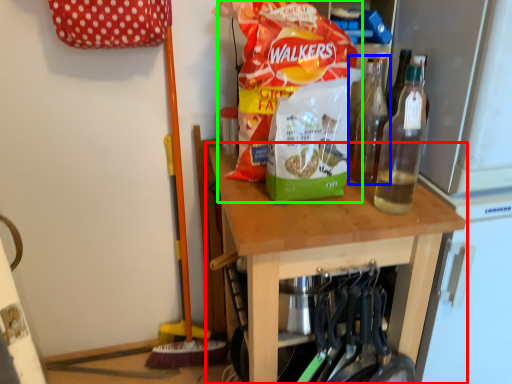
Question: Which is nearer to the table (highlighted by a red box)? bottle (highlighted by a blue box) or waste (highlighted by a green box).

Choices:
 (A) bottle
 (B) waste

Answer: (B)